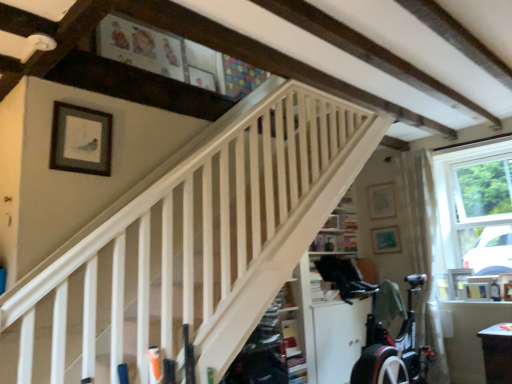
What do you see at coordinates (81, 140) in the screenshot?
I see `matte black picture frame at upper left, marked as the 6th picture frame in a right-to-left arrangement` at bounding box center [81, 140].

What do you see at coordinates (189, 254) in the screenshot?
I see `white wooden stairs at center` at bounding box center [189, 254].

In order to face matte black picture frame at lower right, arranged as the first picture frame when ordered from the bottom, should I rotate leftwards or rightwards?

Rotate right and turn 27.238 degrees.

What do you see at coordinates (477, 291) in the screenshot?
I see `matte black picture frame at lower right, the 2th picture frame viewed from the right` at bounding box center [477, 291].

What do you see at coordinates (422, 248) in the screenshot?
I see `white sheer curtain at right` at bounding box center [422, 248].

Locate an element on the screen. green matte picture frame at upper right, which is the third picture frame from left to right is located at coordinates (385, 240).

This screenshot has height=384, width=512. Find the location of `wooden picture frame at right, acting as the 3th picture frame starting from the back`. wooden picture frame at right, acting as the 3th picture frame starting from the back is located at coordinates (458, 281).

Identify the location of matte black picture frame at upper left, which is the 1th picture frame from left to right. This screenshot has width=512, height=384. (81, 140).

Between green matte picture frame at upper right, the 2th picture frame viewed from the back, and white sheer curtain at right, which one has smaller width?

green matte picture frame at upper right, the 2th picture frame viewed from the back.

From the image's perspective, is green matte picture frame at upper right, arranged as the fourth picture frame when viewed from the right, located beneath white sheer curtain at right?

No, from the image's perspective, green matte picture frame at upper right, arranged as the fourth picture frame when viewed from the right, is not below white sheer curtain at right.

Which object is positioned more to the right, green matte picture frame at upper right, marked as the 4th picture frame in a bottom-to-top arrangement, or white sheer curtain at right?

white sheer curtain at right is more to the right.

Consider the image. Which of these two, green matte picture frame at upper right, which is the third picture frame from left to right, or white sheer curtain at right, stands taller?

With more height is white sheer curtain at right.

Does matte wooden picture frame at upper right, marked as the 2th picture frame in a top-to-bottom arrangement, appear on the right side of white wooden stairs at center?

Yes, matte wooden picture frame at upper right, marked as the 2th picture frame in a top-to-bottom arrangement, is to the right of white wooden stairs at center.

From the image's perspective, is matte wooden picture frame at upper right, the 6th picture frame in the front-to-back sequence, positioned above or below white wooden stairs at center?

matte wooden picture frame at upper right, the 6th picture frame in the front-to-back sequence, is above white wooden stairs at center.

Is matte wooden picture frame at upper right, the 6th picture frame in the front-to-back sequence, outside of white wooden stairs at center?

matte wooden picture frame at upper right, the 6th picture frame in the front-to-back sequence, is positioned outside white wooden stairs at center.

From their relative heights in the image, would you say matte wooden picture frame at upper right, the 6th picture frame in the front-to-back sequence, is taller or shorter than white wooden stairs at center?

Considering their sizes, matte wooden picture frame at upper right, the 6th picture frame in the front-to-back sequence, has less height than white wooden stairs at center.

Looking at this image, is matte black picture frame at upper left, which is the sixth picture frame from back to front, thinner than wooden picture frame at right, which is the third picture frame from right to left?

Correct, the width of matte black picture frame at upper left, which is the sixth picture frame from back to front, is less than that of wooden picture frame at right, which is the third picture frame from right to left.

You are a GUI agent. You are given a task and a screenshot of the screen. Output one action in this format:
    pyautogui.click(x=<x>, y=<y>)
    Task: Click on the picture frame that is the 3rd object to the right of the matte black picture frame at upper left, the first picture frame positioned from the front, starting at the anchor
    This screenshot has width=512, height=384.
    Given the screenshot: What is the action you would take?
    (x=458, y=281)

From a real-world perspective, who is located lower, matte black picture frame at upper left, the first picture frame positioned from the front, or wooden picture frame at right, which is the third picture frame from right to left?

wooden picture frame at right, which is the third picture frame from right to left, is physically lower.

From the image's perspective, who appears lower, matte black picture frame at upper left, which is the sixth picture frame from back to front, or wooden picture frame at right, the second picture frame when ordered from bottom to top?

wooden picture frame at right, the second picture frame when ordered from bottom to top, from the image's perspective.

Is white sheer curtain at right thinner than green matte picture frame at upper right, the 5th picture frame in the front-to-back sequence?

Incorrect, the width of white sheer curtain at right is not less than that of green matte picture frame at upper right, the 5th picture frame in the front-to-back sequence.

Which of these two, white sheer curtain at right or green matte picture frame at upper right, arranged as the fourth picture frame when viewed from the right, is bigger?

white sheer curtain at right is bigger.

Between white sheer curtain at right and green matte picture frame at upper right, which is the third picture frame from left to right, which one has less height?

green matte picture frame at upper right, which is the third picture frame from left to right, is shorter.

Is white sheer curtain at right behind green matte picture frame at upper right, arranged as the fourth picture frame when viewed from the right?

No, it is not.

Could you tell me if wooden picture frame at right, which is the third picture frame from right to left, is facing matte black picture frame at lower right, which appears as the sixth picture frame when viewed from the top?

Yes, wooden picture frame at right, which is the third picture frame from right to left, faces towards matte black picture frame at lower right, which appears as the sixth picture frame when viewed from the top.

From the picture: Measure the distance from wooden picture frame at right, the second picture frame when ordered from bottom to top, to matte black picture frame at lower right, marked as the third picture frame in a front-to-back arrangement.

The distance of wooden picture frame at right, the second picture frame when ordered from bottom to top, from matte black picture frame at lower right, marked as the third picture frame in a front-to-back arrangement, is 12.62 centimeters.

Which object is positioned more to the left, wooden picture frame at right, placed as the 5th picture frame when sorted from top to bottom, or matte black picture frame at lower right, the fifth picture frame in the left-to-right sequence?

wooden picture frame at right, placed as the 5th picture frame when sorted from top to bottom.

From a real-world perspective, which is physically below, wooden picture frame at right, the second picture frame when ordered from bottom to top, or matte black picture frame at lower right, arranged as the first picture frame when ordered from the bottom?

From a 3D spatial view, matte black picture frame at lower right, arranged as the first picture frame when ordered from the bottom, is below.

Can you tell me how much matte black picture frame at lower right, arranged as the first picture frame when ordered from the bottom, and wooden picture frame at right, which is the third picture frame from right to left, differ in facing direction?

13.2 degrees.

Relative to wooden picture frame at right, acting as the 3th picture frame starting from the back, is matte black picture frame at lower right, the fifth picture frame in the left-to-right sequence, in front or behind?

matte black picture frame at lower right, the fifth picture frame in the left-to-right sequence, is positioned closer to the viewer than wooden picture frame at right, acting as the 3th picture frame starting from the back.

Is matte black picture frame at lower right, the 2th picture frame viewed from the right, next to wooden picture frame at right, the second picture frame when ordered from bottom to top?

There is a gap between matte black picture frame at lower right, the 2th picture frame viewed from the right, and wooden picture frame at right, the second picture frame when ordered from bottom to top.

Is wooden picture frame at right, placed as the 5th picture frame when sorted from top to bottom, at the back of matte black picture frame at lower right, marked as the third picture frame in a front-to-back arrangement?

Yes, matte black picture frame at lower right, marked as the third picture frame in a front-to-back arrangement, is positioned with its back facing wooden picture frame at right, placed as the 5th picture frame when sorted from top to bottom.

Does point (391, 199) appear closer or farther from the camera than point (500, 328)?

Point (391, 199) is positioned farther from the camera compared to point (500, 328).

Consider the image. Is matte wooden picture frame at upper right, which is counted as the 5th picture frame, starting from the bottom, not inside white glossy table at lower right?

matte wooden picture frame at upper right, which is counted as the 5th picture frame, starting from the bottom, lies outside white glossy table at lower right's area.

Which of these two, matte wooden picture frame at upper right, which is counted as the 5th picture frame, starting from the bottom, or white glossy table at lower right, is thinner?

matte wooden picture frame at upper right, which is counted as the 5th picture frame, starting from the bottom.

Consider the image. From a real-world perspective, is matte wooden picture frame at upper right, the 6th picture frame in the front-to-back sequence, above or below white glossy table at lower right?

From a real-world perspective, matte wooden picture frame at upper right, the 6th picture frame in the front-to-back sequence, is physically above white glossy table at lower right.

The width and height of the screenshot is (512, 384). I want to click on picture frame that is the 1st one above the white sheer curtain at right (from a real-world perspective), so click(x=385, y=240).

Which picture frame is the 6th one when counting from the back of the white wooden stairs at center? Please provide its 2D coordinates.

[(381, 201)]

Which object lies further to the anchor point matte black picture frame at lower right, placed as the 4th picture frame when sorted from back to front, wooden picture frame at right, the 5th picture frame positioned from the back, or white glossy table at lower right?

Among the two, white glossy table at lower right is located further to matte black picture frame at lower right, placed as the 4th picture frame when sorted from back to front.

When comparing their distances from white sheer curtain at right, does matte wooden picture frame at upper right, which is counted as the 5th picture frame, starting from the bottom, or wooden picture frame at right, which is the second picture frame from front to back, seem further?

Among the two, wooden picture frame at right, which is the second picture frame from front to back, is located further to white sheer curtain at right.

Estimate the real-world distances between objects in this image. Which object is further from white glossy table at lower right, matte black picture frame at lower right, marked as the third picture frame in a front-to-back arrangement, or wooden picture frame at right, which ranks as the 4th picture frame in top-to-bottom order?

matte black picture frame at lower right, marked as the third picture frame in a front-to-back arrangement.

Estimate the real-world distances between objects in this image. Which object is further from matte wooden picture frame at upper right, which is counted as the 5th picture frame, starting from the bottom, wooden picture frame at right, placed as the fourth picture frame when sorted from left to right, or white glossy table at lower right?

Based on the image, white glossy table at lower right appears to be further to matte wooden picture frame at upper right, which is counted as the 5th picture frame, starting from the bottom.

Considering their positions, is wooden picture frame at right, which is the second picture frame from front to back, positioned further to matte black picture frame at lower right, the 2th picture frame viewed from the right, than white sheer curtain at right?

white sheer curtain at right is further to matte black picture frame at lower right, the 2th picture frame viewed from the right.

From the picture: Estimate the real-world distances between objects in this image. Which object is further from matte wooden picture frame at upper right, which is counted as the 5th picture frame, starting from the bottom, matte black picture frame at upper left, the first picture frame positioned from the front, or white sheer curtain at right?

The object further to matte wooden picture frame at upper right, which is counted as the 5th picture frame, starting from the bottom, is matte black picture frame at upper left, the first picture frame positioned from the front.

Which object lies nearer to the anchor point matte black picture frame at upper left, marked as the 6th picture frame in a right-to-left arrangement, wooden picture frame at right, the 5th picture frame positioned from the back, or white sheer curtain at right?

Among the two, white sheer curtain at right is located nearer to matte black picture frame at upper left, marked as the 6th picture frame in a right-to-left arrangement.

When comparing their distances from wooden picture frame at right, which appears as the third picture frame when ordered from the bottom, does green matte picture frame at upper right, the 5th picture frame in the front-to-back sequence, or matte black picture frame at lower right, placed as the 4th picture frame when sorted from back to front, seem further?

green matte picture frame at upper right, the 5th picture frame in the front-to-back sequence.

I want to click on table between white wooden stairs at center and white sheer curtain at right in the front-back direction, so click(x=497, y=353).

The image size is (512, 384). I want to click on table situated between matte black picture frame at upper left, acting as the first picture frame starting from the top, and matte black picture frame at lower right, the fifth picture frame in the left-to-right sequence, from left to right, so [497, 353].

At what (x,y) coordinates should I click in order to perform the action: click on stairs located between matte black picture frame at upper left, the 6th picture frame in the bottom-to-top sequence, and wooden picture frame at right, placed as the fourth picture frame when sorted from left to right, in the left-right direction. Please return your answer as a coordinate pair (x, y). Looking at the image, I should click on (189, 254).

Find the location of `curtain between matte wooden picture frame at upper right, the 6th picture frame in the front-to-back sequence, and wooden picture frame at right, which is the first picture frame from right to left, from left to right`. curtain between matte wooden picture frame at upper right, the 6th picture frame in the front-to-back sequence, and wooden picture frame at right, which is the first picture frame from right to left, from left to right is located at coordinates (422, 248).